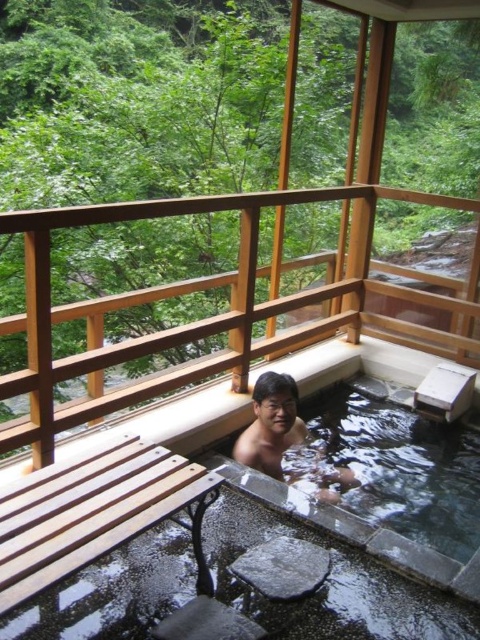
Where is `wooden at center`? wooden at center is located at coordinates (206, 317).

From the picture: Does wooden at center appear on the left side of smooth skin man at center?

Yes, wooden at center is to the left of smooth skin man at center.

Where is `wooden at center`? This screenshot has width=480, height=640. wooden at center is located at coordinates (206, 317).

Consider the image. Who is taller, wooden at center or clear water at tub center?

Standing taller between the two is wooden at center.

Between wooden at center and clear water at tub center, which one appears on the right side from the viewer's perspective?

From the viewer's perspective, clear water at tub center appears more on the right side.

This screenshot has width=480, height=640. What are the coordinates of `wooden at center` in the screenshot? It's located at (206, 317).

This screenshot has width=480, height=640. What are the coordinates of `clear water at tub center` in the screenshot? It's located at (372, 464).

Is point (251, 467) closer to viewer compared to point (268, 456)?

Yes, it is in front of point (268, 456).

Where is `clear water at tub center`? The image size is (480, 640). clear water at tub center is located at coordinates (372, 464).